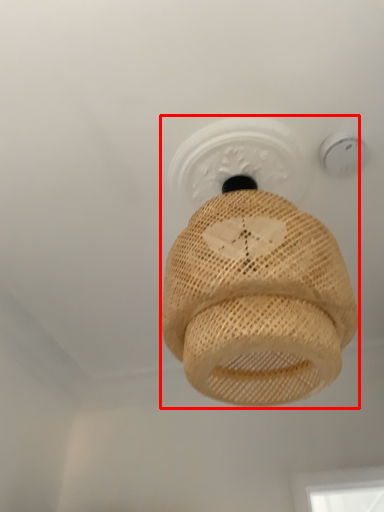
Question: From the image's perspective, what is the correct spatial positioning of lamp (annotated by the red box) in reference to light fixture?

Choices:
 (A) below
 (B) above

Answer: (A)